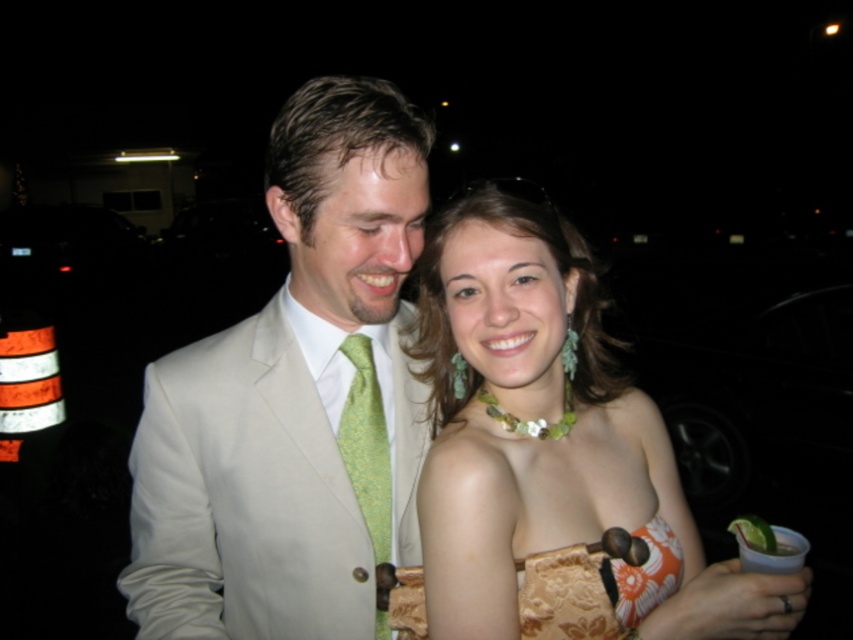
Which is behind, point (202, 595) or point (375, 481)?

Point (375, 481)

Does light beige suit at center appear under green textured tie at center?

No.

This screenshot has width=853, height=640. I want to click on light beige suit at center, so click(294, 400).

Between point (622, 413) and point (380, 419), which one is positioned in front?

Positioned in front is point (622, 413).

Between matte green necklace at center and green textured tie at center, which one is positioned lower?

green textured tie at center is below.

Who is more distant from viewer, (469, 611) or (370, 364)?

Positioned behind is point (370, 364).

Find the location of a particular element. matte green necklace at center is located at coordinates (550, 440).

Which is below, light beige suit at center or white satin suit at center?

Positioned lower is white satin suit at center.

Measure the distance between light beige suit at center and white satin suit at center.

They are 2.54 inches apart.

Between point (303, 100) and point (392, 216), which one is positioned behind?

The point (303, 100) is behind.

Identify the location of light beige suit at center. The image size is (853, 640). (294, 400).